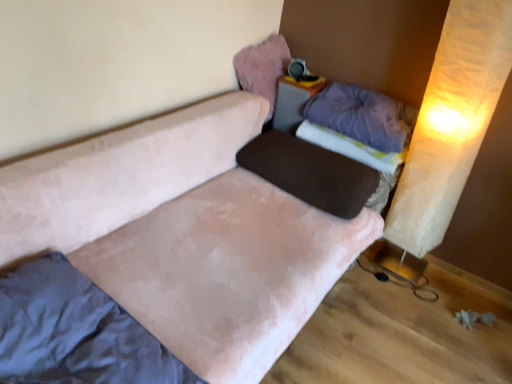
Question: Is purple soft pillow at upper right, the 2th pillow ordered from the bottom, further to the viewer compared to matte plastic table at upper center?

Choices:
 (A) yes
 (B) no

Answer: (B)

Question: From the image's perspective, is purple soft pillow at upper right, the 2th pillow ordered from the bottom, below matte plastic table at upper center?

Choices:
 (A) yes
 (B) no

Answer: (A)

Question: Can you confirm if purple soft pillow at upper right, the 2th pillow ordered from the bottom, is thinner than matte plastic table at upper center?

Choices:
 (A) no
 (B) yes

Answer: (A)

Question: Is purple soft pillow at upper right, which appears as the 2th pillow when viewed from the top, facing away from matte plastic table at upper center?

Choices:
 (A) no
 (B) yes

Answer: (A)

Question: From a real-world perspective, is purple soft pillow at upper right, which appears as the 2th pillow when viewed from the top, under matte plastic table at upper center?

Choices:
 (A) no
 (B) yes

Answer: (A)

Question: Based on their positions, is velvet pink pillow at upper center, the 1th pillow in the top-to-bottom sequence, located to the left or right of matte plastic table at upper center?

Choices:
 (A) left
 (B) right

Answer: (A)

Question: Looking at their shapes, would you say velvet pink pillow at upper center, arranged as the third pillow when ordered from the bottom, is wider or thinner than matte plastic table at upper center?

Choices:
 (A) wide
 (B) thin

Answer: (A)

Question: Looking at the image, does velvet pink pillow at upper center, arranged as the third pillow when ordered from the bottom, seem bigger or smaller compared to matte plastic table at upper center?

Choices:
 (A) big
 (B) small

Answer: (A)

Question: Does point (263, 72) appear closer or farther from the camera than point (285, 97)?

Choices:
 (A) farther
 (B) closer

Answer: (A)

Question: Based on their sizes in the image, would you say velvet pink pillow at upper center, arranged as the third pillow when ordered from the bottom, is bigger or smaller than purple soft pillow at upper right, the 2th pillow ordered from the bottom?

Choices:
 (A) big
 (B) small

Answer: (B)

Question: Looking at their shapes, would you say velvet pink pillow at upper center, arranged as the third pillow when ordered from the bottom, is wider or thinner than purple soft pillow at upper right, the 2th pillow ordered from the bottom?

Choices:
 (A) wide
 (B) thin

Answer: (B)

Question: Is velvet pink pillow at upper center, arranged as the third pillow when ordered from the bottom, taller or shorter than purple soft pillow at upper right, which appears as the 2th pillow when viewed from the top?

Choices:
 (A) short
 (B) tall

Answer: (B)

Question: From a real-world perspective, is velvet pink pillow at upper center, arranged as the third pillow when ordered from the bottom, physically located above or below purple soft pillow at upper right, which appears as the 2th pillow when viewed from the top?

Choices:
 (A) below
 (B) above

Answer: (B)

Question: Considering the relative positions of beige paper curtain at right and matte plastic table at upper center in the image provided, is beige paper curtain at right to the left or to the right of matte plastic table at upper center?

Choices:
 (A) right
 (B) left

Answer: (A)

Question: Is beige paper curtain at right wider or thinner than matte plastic table at upper center?

Choices:
 (A) thin
 (B) wide

Answer: (A)